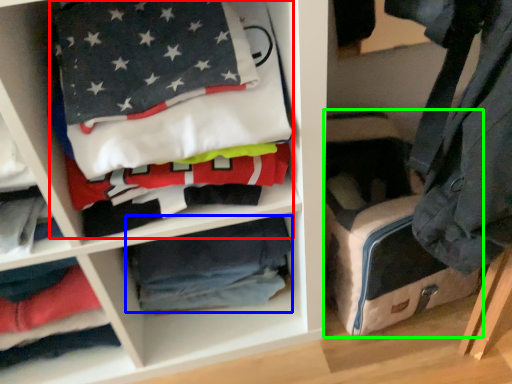
Question: Based on their relative distances, which object is nearer to laundry (highlighted by a red box)? Choose from material (highlighted by a blue box) and pack (highlighted by a green box).

Choices:
 (A) material
 (B) pack

Answer: (A)